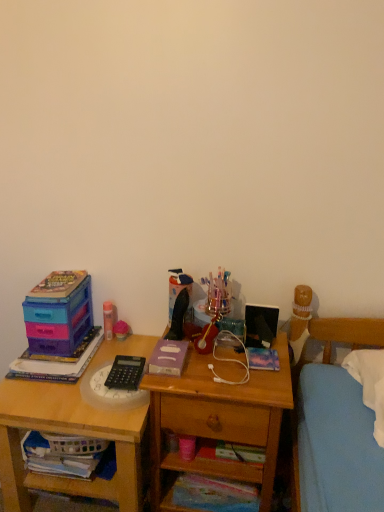
Where is `wooden nightstand at center`? The height and width of the screenshot is (512, 384). wooden nightstand at center is located at coordinates (218, 420).

Describe the element at coordinates (126, 373) in the screenshot. The image size is (384, 512). I see `black plastic calculator at center, which is the first stationery in right-to-left order` at that location.

Locate an element on the screen. This screenshot has height=512, width=384. metallic blue book at center, which ranks as the 1th book in right-to-left order is located at coordinates (263, 359).

From a real-world perspective, who is located higher, metallic blue book at center, the fifth book when ordered from left to right, or pink matte glue stick at upper left, the 2th stationery in the front-to-back sequence?

From a 3D spatial view, metallic blue book at center, the fifth book when ordered from left to right, is above.

From the image's perspective, which is above, metallic blue book at center, the 4th book from the bottom, or pink matte glue stick at upper left, the 2th stationery in the front-to-back sequence?

pink matte glue stick at upper left, the 2th stationery in the front-to-back sequence, is shown above in the image.

Is metallic blue book at center, the 4th book from the bottom, surrounding pink matte glue stick at upper left, placed as the 1th stationery when sorted from top to bottom?

Definitely not — pink matte glue stick at upper left, placed as the 1th stationery when sorted from top to bottom, is not inside metallic blue book at center, the 4th book from the bottom.

Between pink matte glue stick at upper left, placed as the 1th stationery when sorted from top to bottom, and matte purple plastic toy at left, arranged as the 3th book when ordered from the bottom, which one has larger size?

With larger size is matte purple plastic toy at left, arranged as the 3th book when ordered from the bottom.

Is pink matte glue stick at upper left, which is the first stationery from back to front, oriented towards matte purple plastic toy at left, which appears as the fifth book when viewed from the right?

No, pink matte glue stick at upper left, which is the first stationery from back to front, is not facing towards matte purple plastic toy at left, which appears as the fifth book when viewed from the right.

Is pink matte glue stick at upper left, arranged as the second stationery when viewed from the right, not near matte purple plastic toy at left, the 3th book from the top?

That's not correct — pink matte glue stick at upper left, arranged as the second stationery when viewed from the right, is a little close to matte purple plastic toy at left, the 3th book from the top.

Is pink matte glue stick at upper left, which is the first stationery from back to front, at the right side of matte purple plastic toy at left, the 3th book from the top?

Yes, pink matte glue stick at upper left, which is the first stationery from back to front, is to the right of matte purple plastic toy at left, the 3th book from the top.

Based on the photo, could you tell me if matte plastic toy at center is turned towards wooden desk at left?

No, matte plastic toy at center is not turned towards wooden desk at left.

Which is more distant, [114,327] or [133,448]?

Point [114,327]

Is wooden desk at left completely or partially inside matte plastic toy at center?

Actually, wooden desk at left is outside matte plastic toy at center.

Is wooden nightstand at center far away from purple matte book at center, which is counted as the 1th book, starting from the top?

That's not correct — wooden nightstand at center is a little close to purple matte book at center, which is counted as the 1th book, starting from the top.

You are a GUI agent. You are given a task and a screenshot of the screen. Output one action in this format:
    pyautogui.click(x=<x>, y=<y>)
    Task: Click on the nightstand in front of the purple matte book at center, which is the fifth book from bottom to top
    This screenshot has width=384, height=512.
    Given the screenshot: What is the action you would take?
    pyautogui.click(x=218, y=420)

Considering the positions of points (160, 432) and (177, 346), is point (160, 432) closer to camera compared to point (177, 346)?

No, (160, 432) is further to viewer.

Does wooden nightstand at center lie in front of purple matte book at center, which is counted as the 1th book, starting from the top?

Yes.

Is wooden desk at left taller or shorter than wooden nightstand at center?

Considering their sizes, wooden desk at left has less height than wooden nightstand at center.

Does wooden desk at left contain wooden nightstand at center?

Actually, wooden nightstand at center is outside wooden desk at left.

How different are the orientations of wooden desk at left and wooden nightstand at center in degrees?

The angle between the facing direction of wooden desk at left and the facing direction of wooden nightstand at center is 0.763 degrees.

Locate an element on the screen. The image size is (384, 512). nightstand above the wooden desk at left (from a real-world perspective) is located at coordinates (218, 420).

Does point (125, 331) come behind point (252, 424)?

That is True.

Considering the relative sizes of matte plastic toy at center and wooden nightstand at center in the image provided, is matte plastic toy at center taller than wooden nightstand at center?

No, matte plastic toy at center is not taller than wooden nightstand at center.

Considering the sizes of matte plastic toy at center and wooden nightstand at center in the image, is matte plastic toy at center wider or thinner than wooden nightstand at center?

Considering their sizes, matte plastic toy at center looks slimmer than wooden nightstand at center.

Is black plastic calculator at center, placed as the first stationery when sorted from front to back, shorter than matte plastic storage box at left?

Indeed, black plastic calculator at center, placed as the first stationery when sorted from front to back, has a lesser height compared to matte plastic storage box at left.

From a real-world perspective, is black plastic calculator at center, which is the first stationery in right-to-left order, located beneath matte plastic storage box at left?

Indeed, from a real-world perspective, black plastic calculator at center, which is the first stationery in right-to-left order, is positioned beneath matte plastic storage box at left.

Visually, is black plastic calculator at center, which appears as the second stationery when viewed from the left, positioned to the left or to the right of matte plastic storage box at left?

Based on their positions, black plastic calculator at center, which appears as the second stationery when viewed from the left, is located to the right of matte plastic storage box at left.

How many degrees apart are the facing directions of black plastic calculator at center, which is the first stationery in right-to-left order, and matte plastic storage box at left?

The facing directions of black plastic calculator at center, which is the first stationery in right-to-left order, and matte plastic storage box at left are 2.25 degrees apart.

Where is `the 1st stationery directly beneath the metallic blue book at center, the fifth book when ordered from left to right (from a real-world perspective)`? This screenshot has height=512, width=384. the 1st stationery directly beneath the metallic blue book at center, the fifth book when ordered from left to right (from a real-world perspective) is located at coordinates (108, 320).

From a real-world perspective, starting from the matte purple plastic toy at left, which appears as the fifth book when viewed from the right, which stationery is the 2nd one vertically above it? Please provide its 2D coordinates.

[(108, 320)]

Based on their spatial positions, is wooden drawer at lower center or white fabric book at lower left, which is counted as the second book, starting from the bottom, further from matte plastic toy at center?

wooden drawer at lower center lies further to matte plastic toy at center than the other object.

In the scene shown: From the image, which object appears to be nearer to matte plastic toy at center, wooden nightstand at center or wooden drawer at lower center?

wooden drawer at lower center is positioned closer to the anchor matte plastic toy at center.

Which object lies nearer to the anchor point black plastic calculator at center, which appears as the second stationery when viewed from the left, wooden nightstand at center or matte purple plastic toy at left, arranged as the 3th book when ordered from the bottom?

matte purple plastic toy at left, arranged as the 3th book when ordered from the bottom.

When comparing their distances from metallic blue book at center, the 4th book from the bottom, does wooden nightstand at center or purple matte book at center, the 3th book when ordered from right to left, seem further?

Among the two, purple matte book at center, the 3th book when ordered from right to left, is located further to metallic blue book at center, the 4th book from the bottom.

Looking at the image, which one is located further to pink matte glue stick at upper left, the 1th stationery viewed from the left, matte plastic toy at center or matte purple plastic toy at left, which appears as the fifth book when viewed from the right?

Among the two, matte purple plastic toy at left, which appears as the fifth book when viewed from the right, is located further to pink matte glue stick at upper left, the 1th stationery viewed from the left.

Which object lies further to the anchor point purple matte book at center, the 3th book when ordered from left to right, matte plastic toy at center or wooden desk at left?

Among the two, matte plastic toy at center is located further to purple matte book at center, the 3th book when ordered from left to right.

Looking at the image, which one is located further to white fabric book at lower left, which appears as the fourth book when viewed from the top, pink matte glue stick at upper left, the 1th stationery viewed from the left, or black plastic calculator at center, placed as the first stationery when sorted from front to back?

pink matte glue stick at upper left, the 1th stationery viewed from the left, is further to white fabric book at lower left, which appears as the fourth book when viewed from the top.

From the image, which object appears to be farther from purple matte book at center, which is the fifth book from bottom to top, matte plastic storage box at left or pink matte glue stick at upper left, the 1th stationery viewed from the left?

The object further to purple matte book at center, which is the fifth book from bottom to top, is matte plastic storage box at left.

The image size is (384, 512). Find the location of `stationery between matte purple plastic toy at left, which is the first book from left to right, and white fabric book at lower left, the 2th book when ordered from left to right, in the vertical direction`. stationery between matte purple plastic toy at left, which is the first book from left to right, and white fabric book at lower left, the 2th book when ordered from left to right, in the vertical direction is located at coordinates (126, 373).

Where is `toy located between white fabric book at lower left, which is counted as the fourth book, starting from the right, and metallic blue book at center, which ranks as the 1th book in right-to-left order, in the left-right direction`? toy located between white fabric book at lower left, which is counted as the fourth book, starting from the right, and metallic blue book at center, which ranks as the 1th book in right-to-left order, in the left-right direction is located at coordinates (121, 330).

I want to click on toy located between matte plastic storage box at left and wooden drawer at lower center in the left-right direction, so click(x=121, y=330).

You are a GUI agent. You are given a task and a screenshot of the screen. Output one action in this format:
    pyautogui.click(x=<x>, y=<y>)
    Task: Click on the drawer between pink matte glue stick at upper left, which is the first stationery from back to front, and multicolored paper book at lower center, the second book from the right, vertically
    Image resolution: width=384 pixels, height=512 pixels.
    Given the screenshot: What is the action you would take?
    tap(215, 419)